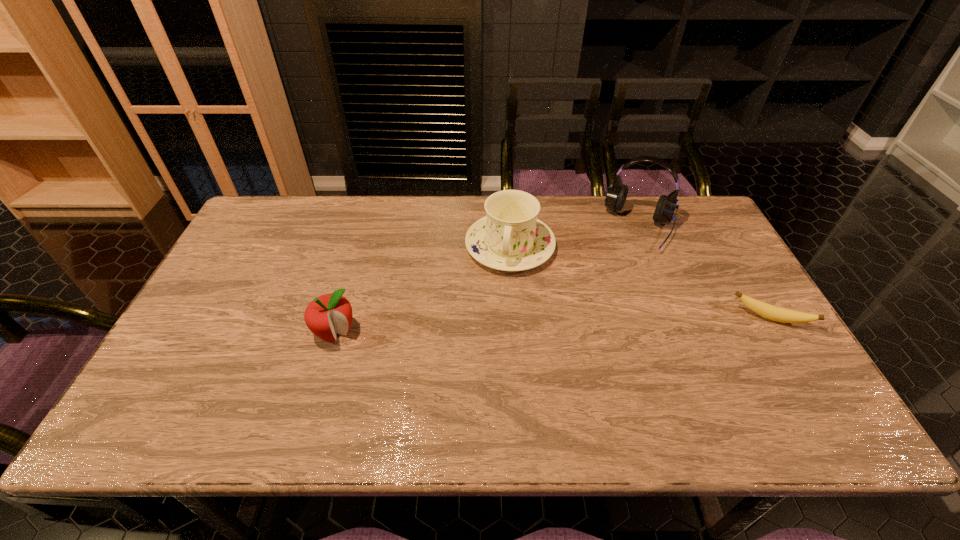
You are a GUI agent. You are given a task and a screenshot of the screen. Output one action in this format:
    pyautogui.click(x=<x>, y=<y>)
    Task: Click on the vacant space on the desktop that is between the apple and the rightmost object and is positioned on the ear cushions of the headset
    The height and width of the screenshot is (540, 960).
    Given the screenshot: What is the action you would take?
    pyautogui.click(x=603, y=323)

Identify the location of vacant space on the desktop that is between the leftmost object and the shortest object and is positioned on the handle side of the third object from right to left. This screenshot has height=540, width=960. (494, 327).